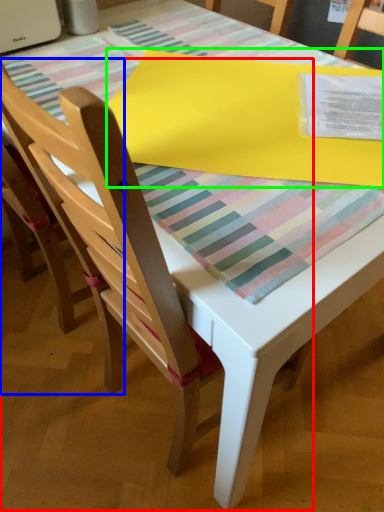
Question: Which is farther away from chair (highlighted by a red box)? chair (highlighted by a blue box) or blanket (highlighted by a green box)?

Choices:
 (A) chair
 (B) blanket

Answer: (B)